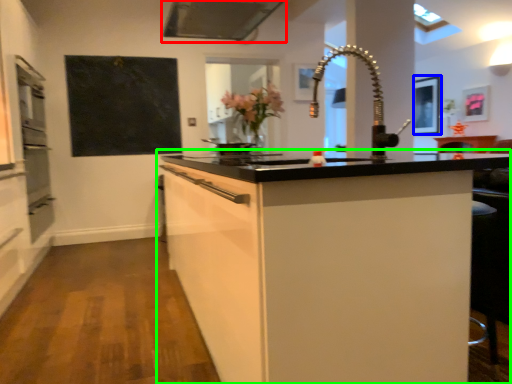
Question: Considering the real-world distances, which object is closest to exhaust hood (highlighted by a red box)? picture frame (highlighted by a blue box) or cabinetry (highlighted by a green box).

Choices:
 (A) picture frame
 (B) cabinetry

Answer: (B)